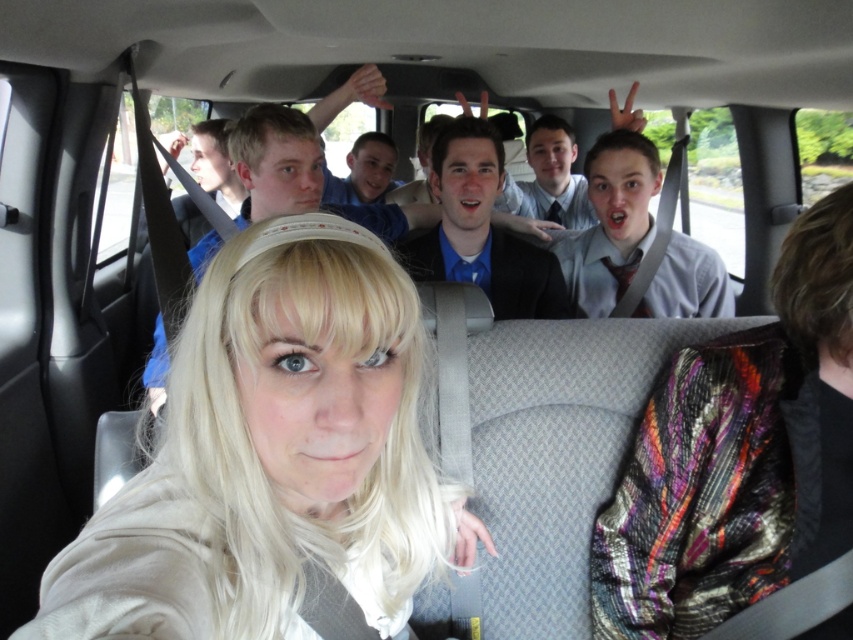
You are a photographer trying to capture a group photo of everyone in the van. You notice the metallic sequined scarf at rear center and the blonde hair at center. Which object is closer to the camera?

The blonde hair at center is closer to the camera than the metallic sequined scarf at rear center because it is shorter in height compared to the scarf.

Based on the scene description, where is the blonde hair at center located in the image?

The blonde hair at center is located at point (x=274, y=458) in the image.